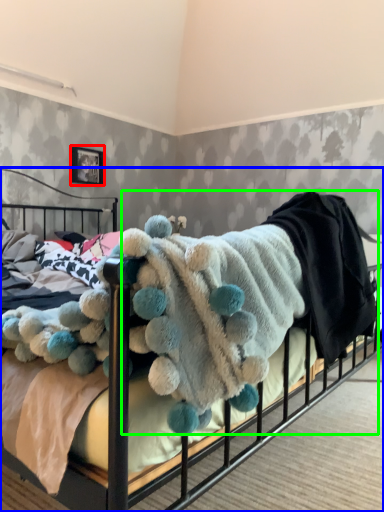
Question: Based on their relative distances, which object is farther from picture frame (highlighted by a red box)? Choose from bed (highlighted by a blue box) and baby clothe (highlighted by a green box).

Choices:
 (A) bed
 (B) baby clothe

Answer: (A)